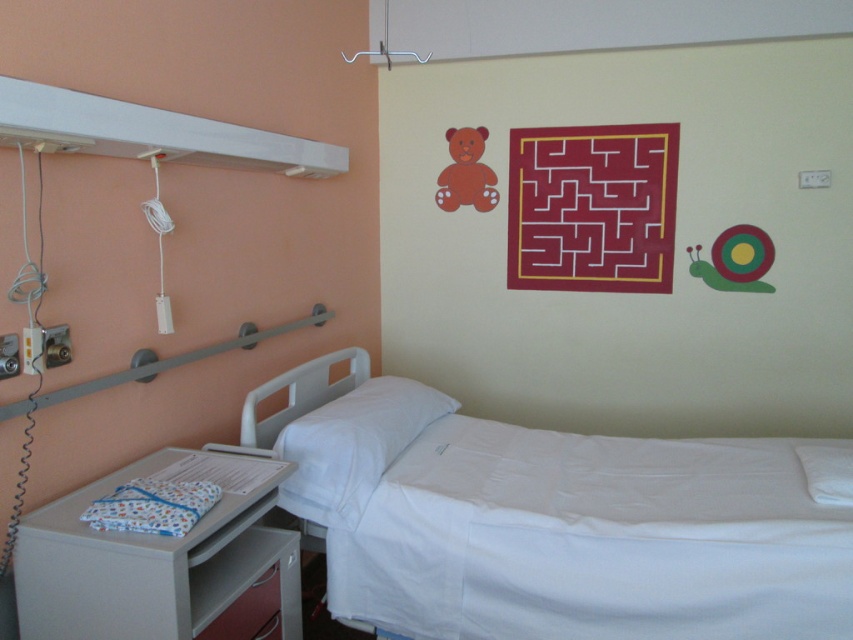
Question: Which object appears closest to the camera in this image?

Choices:
 (A) white plastic tray at lower left
 (B) white smooth bed at center

Answer: (A)

Question: Does white smooth bed at center have a greater width compared to white plastic tray at lower left?

Choices:
 (A) no
 (B) yes

Answer: (B)

Question: Does white smooth bed at center appear on the right side of white plastic tray at lower left?

Choices:
 (A) yes
 (B) no

Answer: (A)

Question: Does white smooth bed at center have a lesser width compared to white plastic tray at lower left?

Choices:
 (A) no
 (B) yes

Answer: (A)